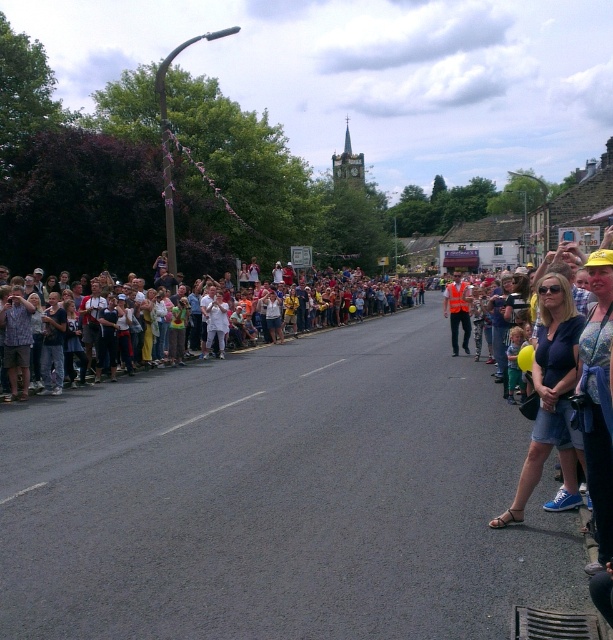
You are a pedestrian trying to cross the street while avoiding obstacles. You see a denim shorts at lower right and an orange reflective vest at center. Which object is closer to you?

The denim shorts at lower right is in front of the orange reflective vest at center, so it is closer to you.

You are a photographer standing in the middle of the street during the event. You want to take a photo of the denim shorts at lower right and the white cotton crowd at left. Which object is positioned lower in the frame?

The denim shorts at lower right is positioned lower in the frame than the white cotton crowd at left.